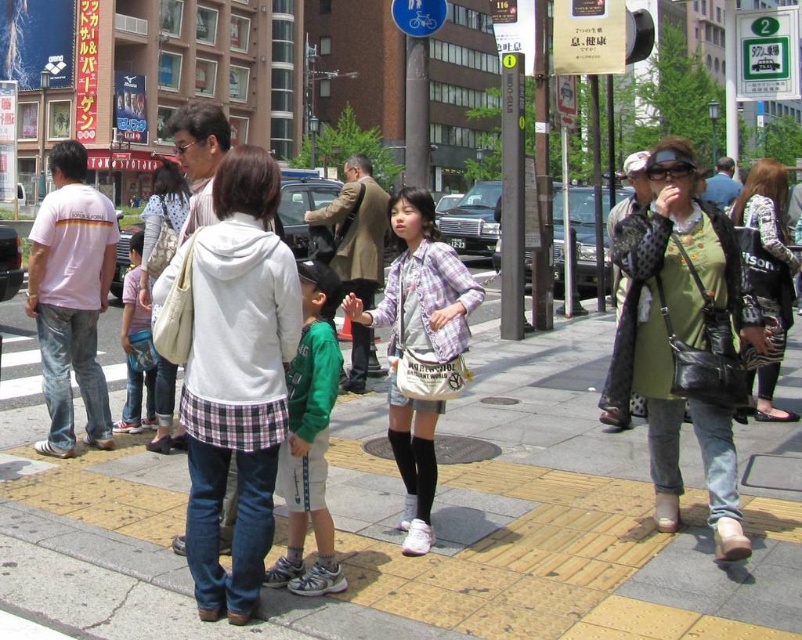
Question: Is white cotton t-shirt at left above green cotton shirt at center?

Choices:
 (A) yes
 (B) no

Answer: (A)

Question: Is white cotton hoodie at center smaller than white cotton t-shirt at left?

Choices:
 (A) no
 (B) yes

Answer: (B)

Question: Which point is closer to the camera taking this photo?

Choices:
 (A) (314, 586)
 (B) (92, 216)

Answer: (A)

Question: Which point appears closest to the camera in this image?

Choices:
 (A) (148, 428)
 (B) (268, 404)
 (C) (310, 285)

Answer: (B)

Question: Is yellow brick pavement at center wider than white cotton hoodie at center?

Choices:
 (A) no
 (B) yes

Answer: (A)

Question: Which point is closer to the camera?

Choices:
 (A) light pink cotton shirt at center
 (B) yellow brick pavement at center
 (C) green cotton shirt at center

Answer: (C)